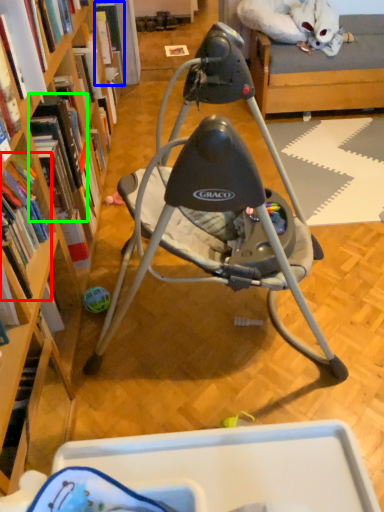
Question: Which object is the closest to the book (highlighted by a red box)? Choose among these: book (highlighted by a blue box) or book (highlighted by a green box).

Choices:
 (A) book
 (B) book

Answer: (B)